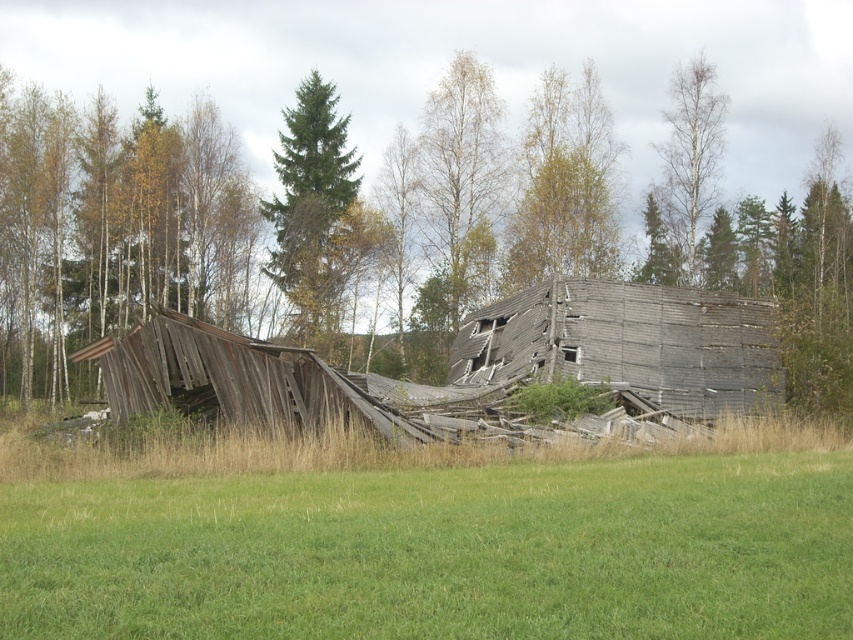
You are standing in the grassy field and want to reach the dense forest in the background. The weathered wood hut at center is in your way. Can you go around it to the left or right side?

The weathered wood hut at center is located at point coordinates, so you can go around it either to the left or right side since it is a single structure in the center of the field.

Looking at this image, you are a hiker trying to determine the best path to avoid the damaged building. You notice a green coniferous tree at center and a bare birch tree at upper right. Which tree should you use as a landmark if you want to stay farther from the damaged building?

Answer: The green coniferous tree at center is larger in size than the bare birch tree at upper right, so using the green coniferous tree at center as a landmark would keep you farther from the damaged building since larger trees often provide more distance from structures.

You are standing in the grassy field in front of the dilapidated wooden structure. You see a point marked at coordinates (292, 221). What does this point represent?

The point at (292, 221) represents the weathered wood structure at center.